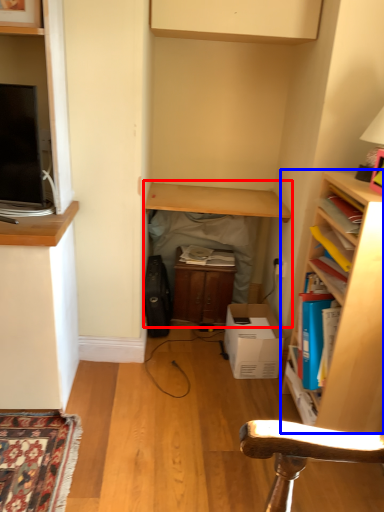
Question: Which point is closer to the camera, table (highlighted by a red box) or shelf (highlighted by a blue box)?

Choices:
 (A) table
 (B) shelf

Answer: (B)